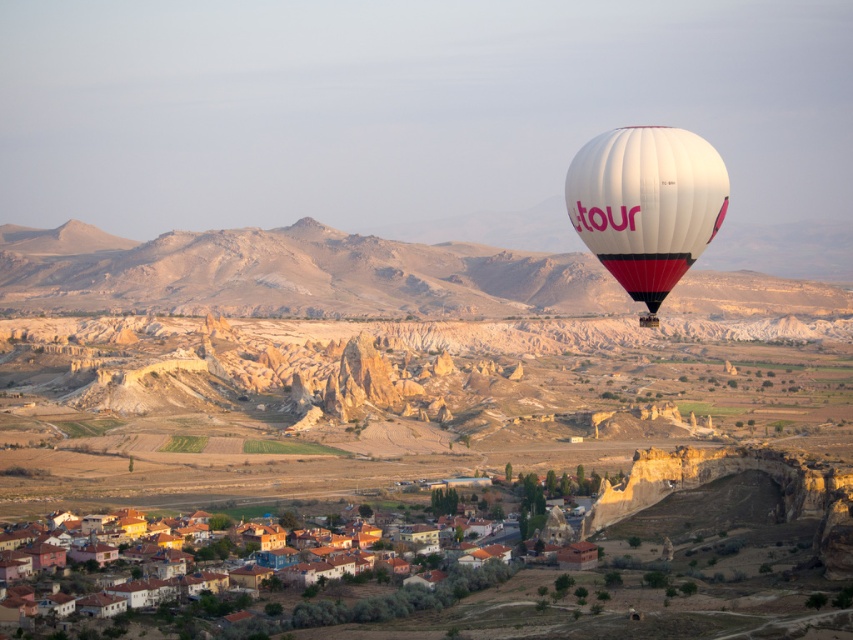
Who is positioned more to the right, white fabric balloon at right or brown tiled roofs at lower center?

From the viewer's perspective, white fabric balloon at right appears more on the right side.

Which of these two, white fabric balloon at right or brown tiled roofs at lower center, stands shorter?

brown tiled roofs at lower center

The height and width of the screenshot is (640, 853). I want to click on white fabric balloon at right, so click(646, 205).